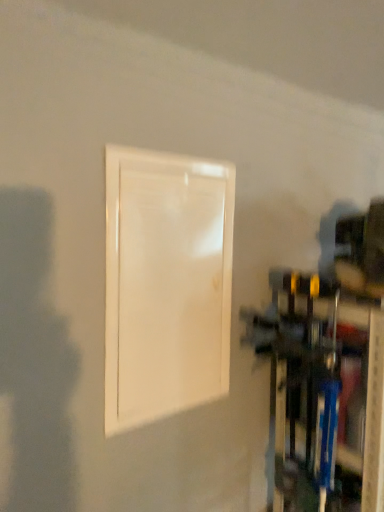
What do you see at coordinates (166, 284) in the screenshot?
I see `white glossy door at center` at bounding box center [166, 284].

This screenshot has width=384, height=512. Identify the location of white glossy door at center. (166, 284).

Measure the distance between blue plastic shelf at lower right and camera.

The distance of blue plastic shelf at lower right from camera is 35.95 inches.

Image resolution: width=384 pixels, height=512 pixels. Find the location of `blue plastic shelf at lower right`. blue plastic shelf at lower right is located at coordinates (324, 396).

What do you see at coordinates (324, 396) in the screenshot? I see `blue plastic shelf at lower right` at bounding box center [324, 396].

I want to click on white glossy door at center, so click(x=166, y=284).

Considering the positions of objects blue plastic shelf at lower right and white glossy door at center in the image provided, who is more to the right, blue plastic shelf at lower right or white glossy door at center?

blue plastic shelf at lower right is more to the right.

Is blue plastic shelf at lower right closer to camera compared to white glossy door at center?

No, blue plastic shelf at lower right is behind white glossy door at center.

Considering the positions of point (264, 338) and point (113, 311), is point (264, 338) closer or farther from the camera than point (113, 311)?

Point (264, 338) is farther from the camera than point (113, 311).

From the image's perspective, does blue plastic shelf at lower right appear higher than white glossy door at center?

No, from the image's perspective, blue plastic shelf at lower right is not over white glossy door at center.

From a real-world perspective, is blue plastic shelf at lower right positioned above or below white glossy door at center?

blue plastic shelf at lower right is situated lower than white glossy door at center in the real world.

Between blue plastic shelf at lower right and white glossy door at center, which one has larger width?

blue plastic shelf at lower right is wider.

From the picture: Is blue plastic shelf at lower right shorter than white glossy door at center?

Incorrect, the height of blue plastic shelf at lower right does not fall short of that of white glossy door at center.

Can you confirm if blue plastic shelf at lower right is bigger than white glossy door at center?

Correct, blue plastic shelf at lower right is larger in size than white glossy door at center.

Do you think blue plastic shelf at lower right is within white glossy door at center, or outside of it?

blue plastic shelf at lower right exists outside the volume of white glossy door at center.

Would you consider blue plastic shelf at lower right to be distant from white glossy door at center?

No.

Could you tell me if blue plastic shelf at lower right is turned towards white glossy door at center?

No, blue plastic shelf at lower right is not oriented towards white glossy door at center.

How different are the orientations of blue plastic shelf at lower right and white glossy door at center in degrees?

The angular difference between blue plastic shelf at lower right and white glossy door at center is 0.46 degrees.

Image resolution: width=384 pixels, height=512 pixels. Identify the location of shelf below the white glossy door at center (from a real-world perspective). (324, 396).

Between white glossy door at center and blue plastic shelf at lower right, which one appears on the left side from the viewer's perspective?

white glossy door at center is more to the left.

Which object is more forward, white glossy door at center or blue plastic shelf at lower right?

white glossy door at center is closer to the camera.

Does point (201, 324) come in front of point (301, 392)?

Yes, it is.

From the image's perspective, which is below, white glossy door at center or blue plastic shelf at lower right?

blue plastic shelf at lower right, from the image's perspective.

From a real-world perspective, between white glossy door at center and blue plastic shelf at lower right, who is vertically higher?

From a 3D spatial view, white glossy door at center is above.

In the scene shown: Can you confirm if white glossy door at center is wider than blue plastic shelf at lower right?

Incorrect, the width of white glossy door at center does not surpass that of blue plastic shelf at lower right.

Who is taller, white glossy door at center or blue plastic shelf at lower right?

Standing taller between the two is blue plastic shelf at lower right.

Considering the relative sizes of white glossy door at center and blue plastic shelf at lower right in the image provided, is white glossy door at center smaller than blue plastic shelf at lower right?

Indeed, white glossy door at center has a smaller size compared to blue plastic shelf at lower right.

Is white glossy door at center inside or outside of blue plastic shelf at lower right?

white glossy door at center is spatially situated outside blue plastic shelf at lower right.

Are white glossy door at center and blue plastic shelf at lower right located far from each other?

No, white glossy door at center is not far from blue plastic shelf at lower right.

Is white glossy door at center positioned with its back to blue plastic shelf at lower right?

white glossy door at center does not have its back to blue plastic shelf at lower right.

Locate an element on the screen. This screenshot has width=384, height=512. shelf lying on the right of white glossy door at center is located at coordinates (324, 396).

Find the location of a particular element. Image resolution: width=384 pixels, height=512 pixels. door above the blue plastic shelf at lower right (from a real-world perspective) is located at coordinates (166, 284).

Find the location of a particular element. The height and width of the screenshot is (512, 384). door above the blue plastic shelf at lower right (from the image's perspective) is located at coordinates (166, 284).